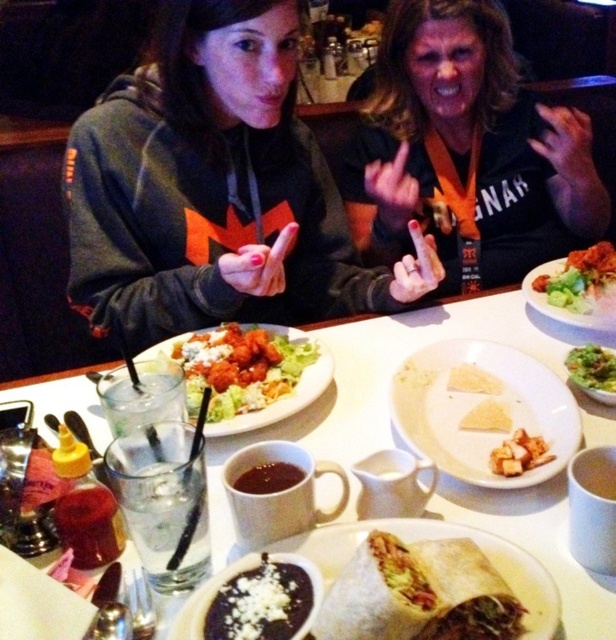
Is green leafy vegetable at center to the right of white crumbly cheese at center from the viewer's perspective?

Correct, you'll find green leafy vegetable at center to the right of white crumbly cheese at center.

Who is positioned more to the left, green leafy vegetable at center or white crumbly cheese at center?

From the viewer's perspective, white crumbly cheese at center appears more on the left side.

Where is `green leafy vegetable at center`? The image size is (616, 640). green leafy vegetable at center is located at coordinates (591, 368).

At what (x,y) coordinates should I click in order to perform the action: click on green leafy vegetable at center. Please return your answer as a coordinate pair (x, y). Looking at the image, I should click on tap(591, 368).

Is matte black hoodie at upper left to the left of dark brown creamy soup at center from the viewer's perspective?

Indeed, matte black hoodie at upper left is positioned on the left side of dark brown creamy soup at center.

Between matte black hoodie at upper left and dark brown creamy soup at center, which one has more height?

matte black hoodie at upper left is taller.

Is point (373, 282) in front of point (270, 604)?

No, (373, 282) is further to viewer.

Find the location of a particular element. The height and width of the screenshot is (640, 616). matte black hoodie at upper left is located at coordinates (216, 189).

Which of these two, yellow crumbly at center or white crumbly cheese at center, stands taller?

white crumbly cheese at center

Which is below, yellow crumbly at center or white crumbly cheese at center?

yellow crumbly at center is lower down.

Between point (477, 406) and point (500, 388), which one is positioned in front?

Point (477, 406)

This screenshot has height=640, width=616. Find the location of `yellow crumbly at center`. yellow crumbly at center is located at coordinates (487, 417).